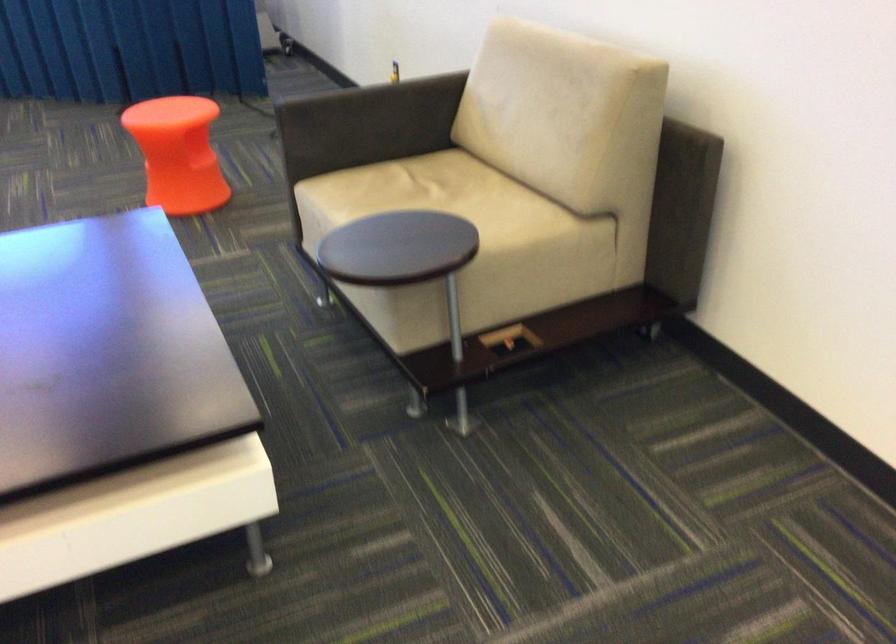
Find where to sit the orange plastic stool. Please return your answer as a coordinate pair (x, y).

(177, 154)